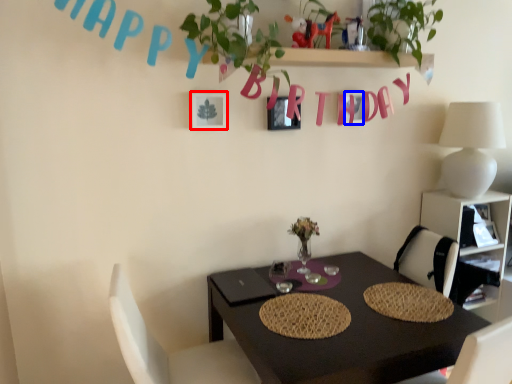
Question: Which of the following is the closest to the observer, picture frame (highlighted by a red box) or alphabet (highlighted by a blue box)?

Choices:
 (A) picture frame
 (B) alphabet

Answer: (A)